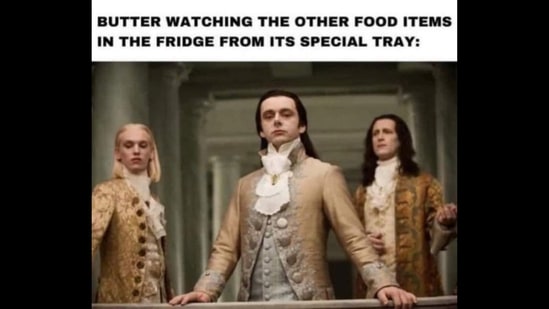
Identify the location of ceiling. 341,116, 343,139.